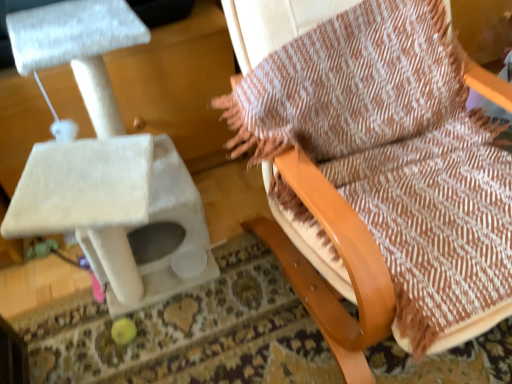
Image resolution: width=512 pixels, height=384 pixels. What do you see at coordinates (395, 154) in the screenshot?
I see `brown woven fabric chair at upper right` at bounding box center [395, 154].

Where is `brown woven fabric chair at upper right`? The image size is (512, 384). brown woven fabric chair at upper right is located at coordinates pyautogui.click(x=395, y=154).

In order to click on brown woven fabric chair at upper right in this screenshot , I will do `click(395, 154)`.